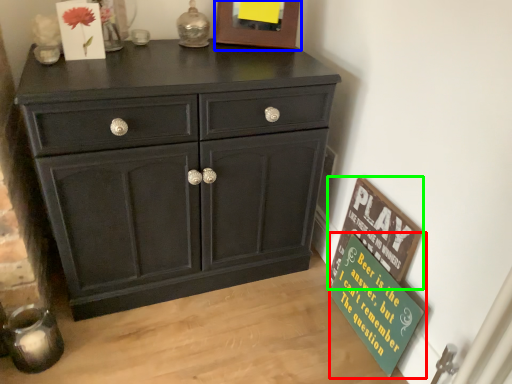
Question: Which object is positioned farthest from bulletin board (highlighted by a red box)? Select from picture frame (highlighted by a blue box) and bulletin board (highlighted by a green box).

Choices:
 (A) picture frame
 (B) bulletin board

Answer: (A)